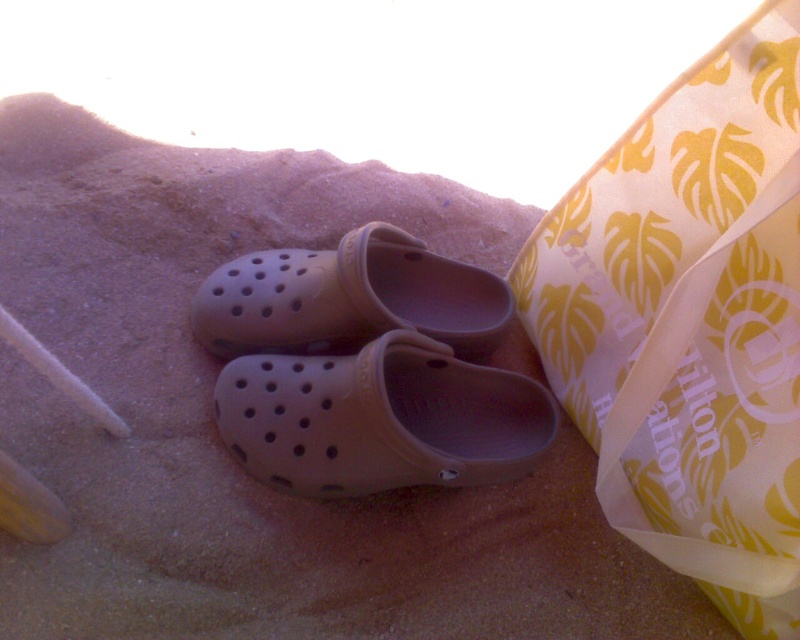
Who is taller, white/yellow fabric at upper right or tan rubber clog at center?

white/yellow fabric at upper right

Does white/yellow fabric at upper right appear on the left side of tan rubber clog at center?

No, white/yellow fabric at upper right is not to the left of tan rubber clog at center.

I want to click on white/yellow fabric at upper right, so click(x=690, y=323).

Does white/yellow fabric at upper right appear on the right side of matte rubber clog at center?

Correct, you'll find white/yellow fabric at upper right to the right of matte rubber clog at center.

Who is more forward, (698, 192) or (389, 285)?

Positioned in front is point (698, 192).

Who is more forward, (x=722, y=468) or (x=256, y=269)?

Point (x=722, y=468) is more forward.

At what (x,y) coordinates should I click in order to perform the action: click on white/yellow fabric at upper right. Please return your answer as a coordinate pair (x, y). The height and width of the screenshot is (640, 800). Looking at the image, I should click on (690, 323).

Can you confirm if tan rubber clog at center is positioned to the right of matte rubber clog at center?

Indeed, tan rubber clog at center is positioned on the right side of matte rubber clog at center.

Who is positioned more to the left, tan rubber clog at center or matte rubber clog at center?

matte rubber clog at center

Who is more forward, [460,381] or [448,268]?

Point [460,381]

At what (x,y) coordinates should I click in order to perform the action: click on tan rubber clog at center. Please return your answer as a coordinate pair (x, y). Looking at the image, I should click on coord(380,419).